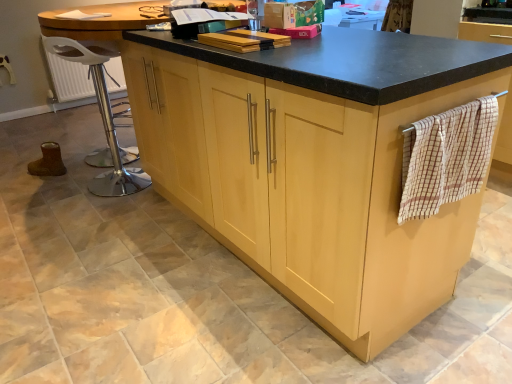
Question: Can you confirm if metallic silver bar stool at left is shorter than beige checkered towel at right?

Choices:
 (A) yes
 (B) no

Answer: (B)

Question: Is metallic silver bar stool at left located outside beige checkered towel at right?

Choices:
 (A) yes
 (B) no

Answer: (A)

Question: Is metallic silver bar stool at left positioned behind beige checkered towel at right?

Choices:
 (A) yes
 (B) no

Answer: (A)

Question: From a real-world perspective, is metallic silver bar stool at left below beige checkered towel at right?

Choices:
 (A) yes
 (B) no

Answer: (A)

Question: Can you confirm if metallic silver bar stool at left is wider than beige checkered towel at right?

Choices:
 (A) no
 (B) yes

Answer: (A)

Question: Does metallic silver bar stool at left have a greater height compared to beige checkered towel at right?

Choices:
 (A) yes
 (B) no

Answer: (A)

Question: Is beige checkered towel at right touching light wood cabinetry at center?

Choices:
 (A) yes
 (B) no

Answer: (B)

Question: Could you tell me if beige checkered towel at right is turned towards light wood cabinetry at center?

Choices:
 (A) no
 (B) yes

Answer: (A)

Question: Is beige checkered towel at right smaller than light wood cabinetry at center?

Choices:
 (A) no
 (B) yes

Answer: (B)

Question: From a real-world perspective, is beige checkered towel at right physically above light wood cabinetry at center?

Choices:
 (A) yes
 (B) no

Answer: (A)

Question: Is light wood cabinetry at center at the back of beige checkered towel at right?

Choices:
 (A) yes
 (B) no

Answer: (B)

Question: From the image's perspective, is beige checkered towel at right on top of light wood cabinetry at center?

Choices:
 (A) no
 (B) yes

Answer: (A)

Question: Does light wood cabinetry at center have a greater height compared to metallic silver bar stool at left?

Choices:
 (A) yes
 (B) no

Answer: (A)